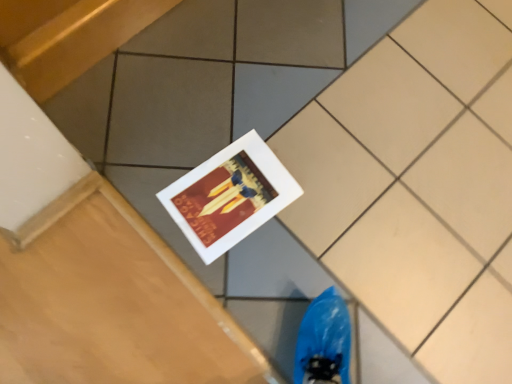
Locate an element on the screen. The width and height of the screenshot is (512, 384). vacant area that is situated to the right of white matte picture frame at center is located at coordinates (322, 222).